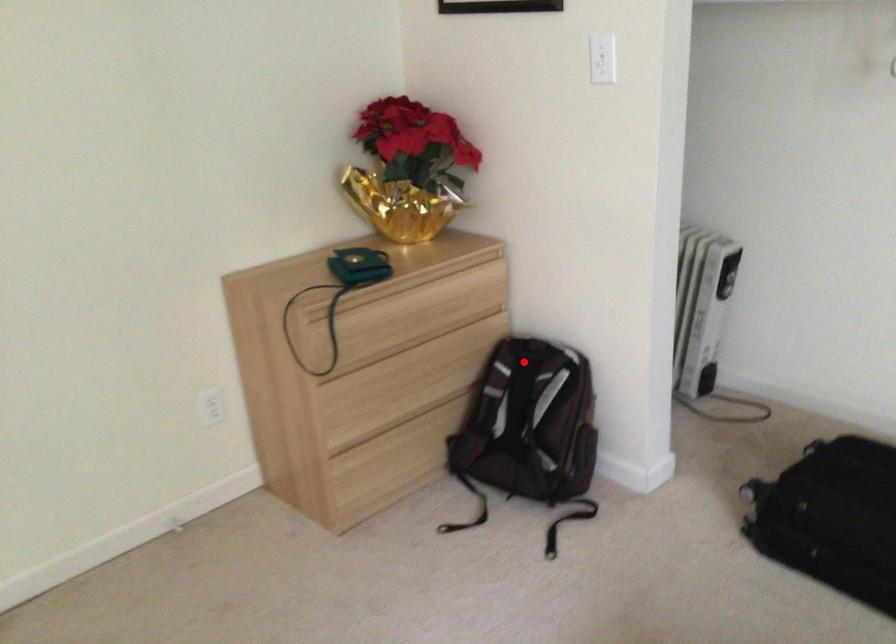
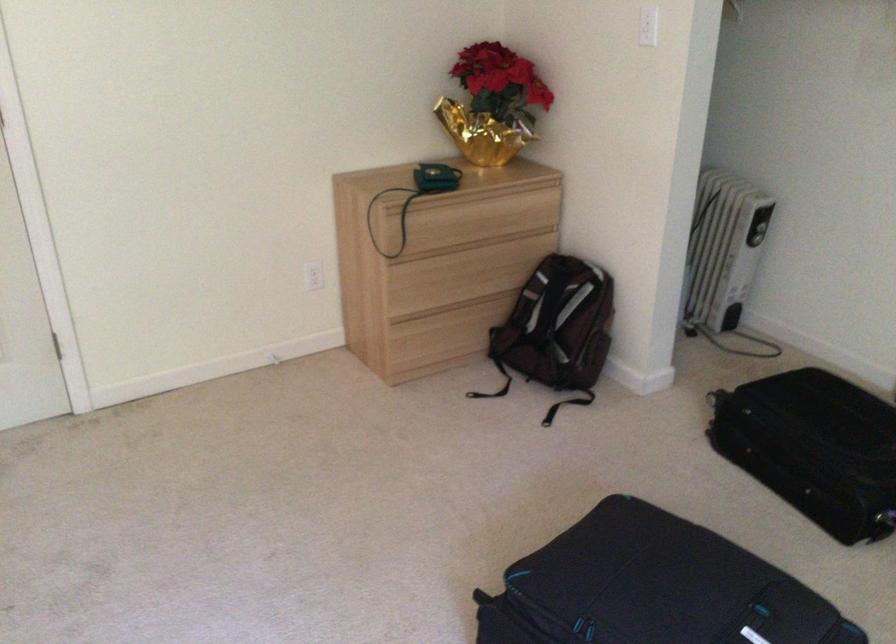
The point at the highlighted location is marked in the first image. Where is the corresponding point in the second image?

(558, 272)